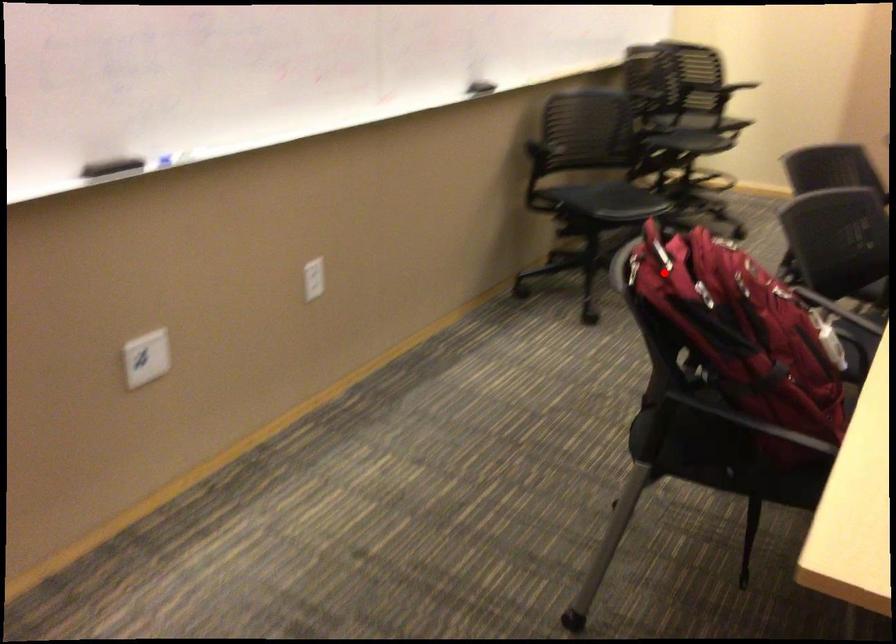
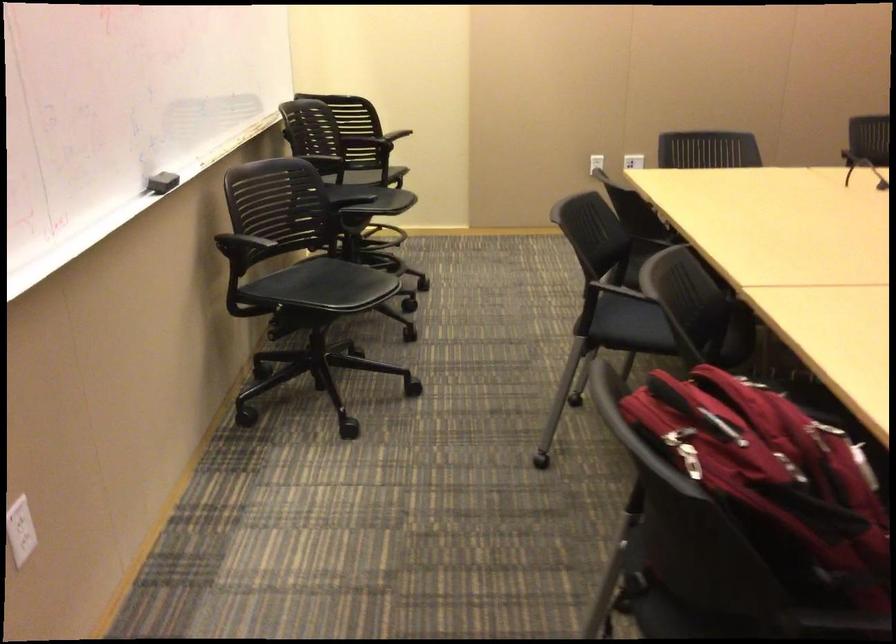
Where in the second image is the point corresponding to the highlighted location from the first image?

(690, 460)